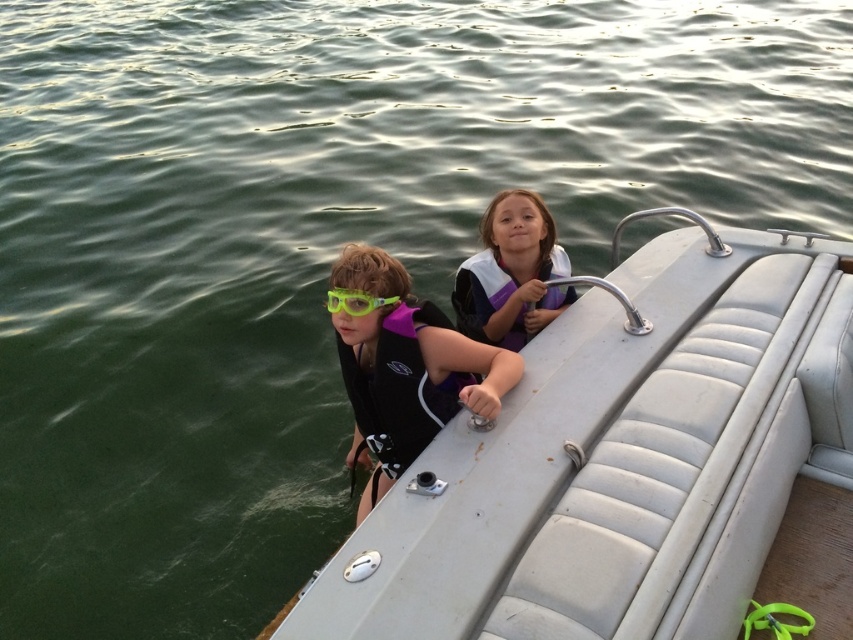
Question: Which object appears farthest from the camera in this image?

Choices:
 (A) purple matte life vest at center
 (B) purple/white life jacket at upper center

Answer: (B)

Question: Can you confirm if purple matte life vest at center is wider than purple neoprene life jacket at left?

Choices:
 (A) no
 (B) yes

Answer: (B)

Question: Which object appears closest to the camera in this image?

Choices:
 (A) purple/white life jacket at upper center
 (B) purple matte life vest at center
 (C) green matte goggles at center
 (D) purple neoprene life jacket at left

Answer: (B)

Question: Is purple matte life vest at center to the right of purple/white life jacket at upper center from the viewer's perspective?

Choices:
 (A) no
 (B) yes

Answer: (A)

Question: Can you confirm if silver leather boat at center is positioned to the right of purple matte life vest at center?

Choices:
 (A) yes
 (B) no

Answer: (A)

Question: Which point is closer to the camera?

Choices:
 (A) silver leather boat at center
 (B) green matte goggles at center
 (C) purple matte life vest at center

Answer: (A)